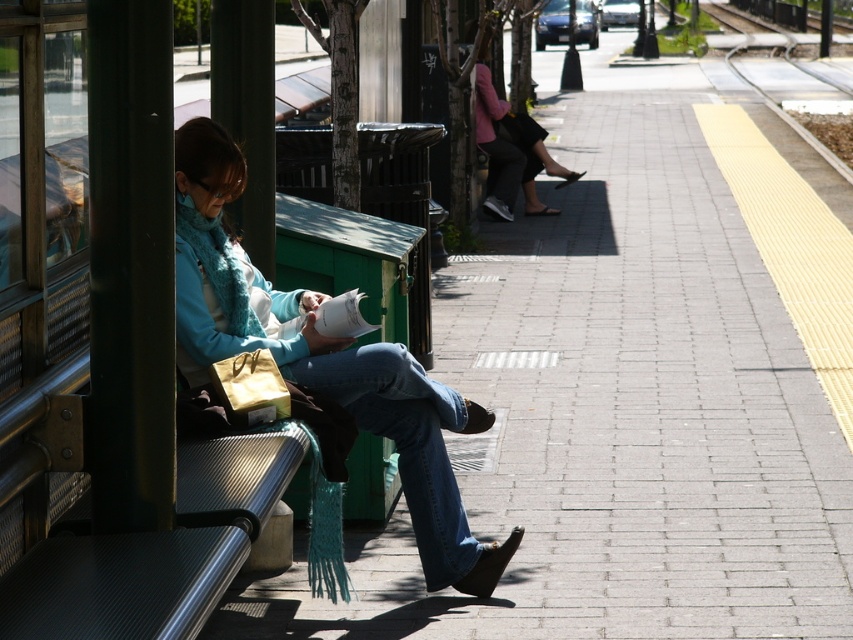
From the picture: You are a pedestrian standing on the platform and see the blue denim jeans at center and the pink fabric jacket at upper center. Which item is positioned higher up in the image?

The pink fabric jacket at upper center is positioned higher up in the image than the blue denim jeans at center.

You are a fashion designer observing the scene at the train station. You notice the blue denim jeans at center and the pink fabric jacket at upper center. Which clothing item appears larger in size?

The pink fabric jacket at upper center appears larger than the blue denim jeans at center.